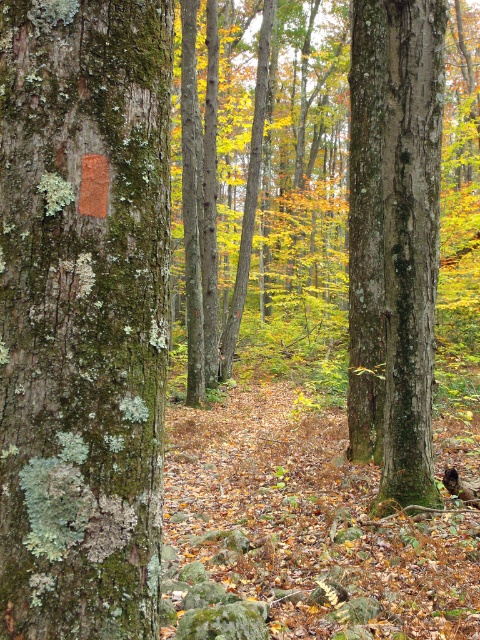
You are a hiker who has lost your way in the forest. You see two trees in front of you, one with green mossy bark at left and another with green rough bark tree trunk at center. Which tree should you head towards if you want to stay on the path that runs between them?

The path runs between the green mossy bark at left and the green rough bark tree trunk at center. Since the green mossy bark at left is positioned to the left of the green rough bark tree trunk at center, you should head towards the green rough bark tree trunk at center to stay on the path between them.

You are standing in the forest and see two points marked on the ground. The first point is at coordinates point [46,349] and the second is at point [367,84]. Which point is closer to you?

Point [46,349] is closer to the camera than point [367,84], so the first point is closer to you.